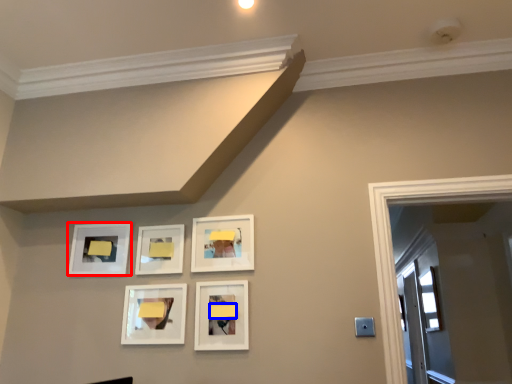
Question: Which object is further to the camera taking this photo, picture frame (highlighted by a red box) or lift (highlighted by a blue box)?

Choices:
 (A) picture frame
 (B) lift

Answer: (A)